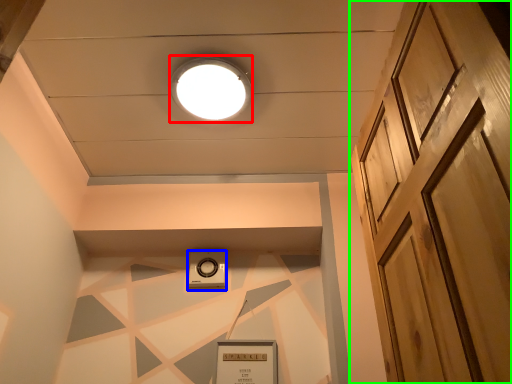
Question: Which object is the farthest from droplight (highlighted by a red box)? Choose among these: thermostat (highlighted by a blue box) or door (highlighted by a green box).

Choices:
 (A) thermostat
 (B) door

Answer: (B)